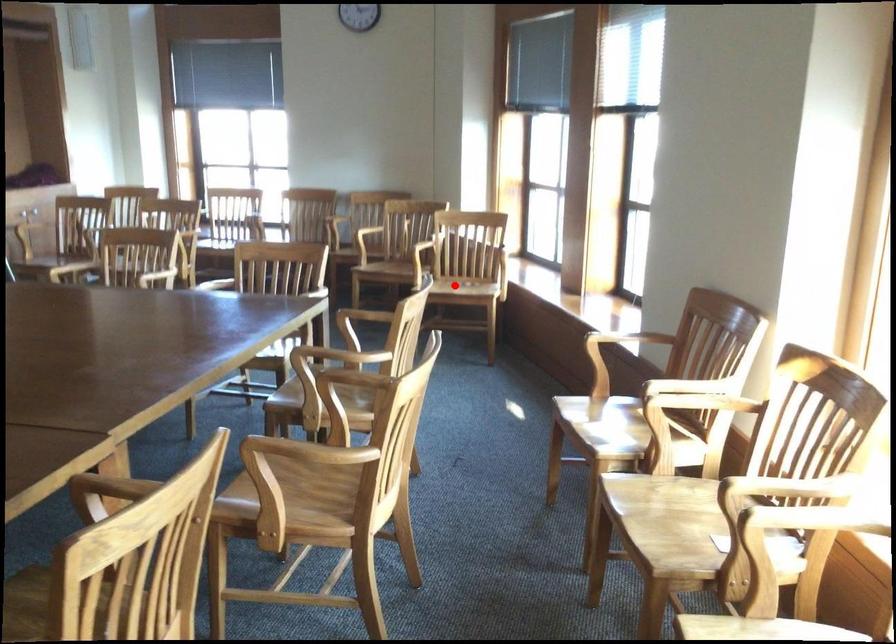
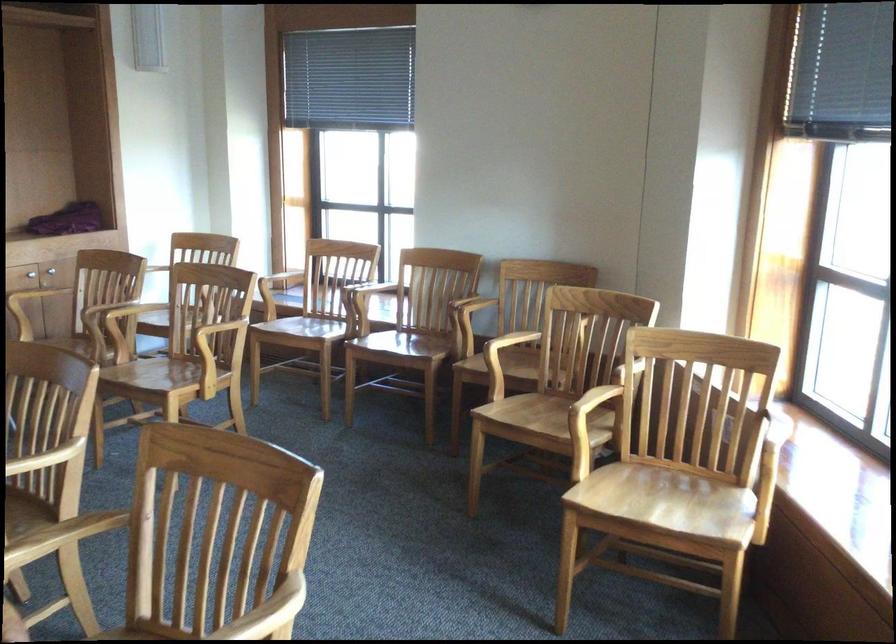
Locate, in the second image, the point that corresponds to the highlighted location in the first image.

(670, 502)